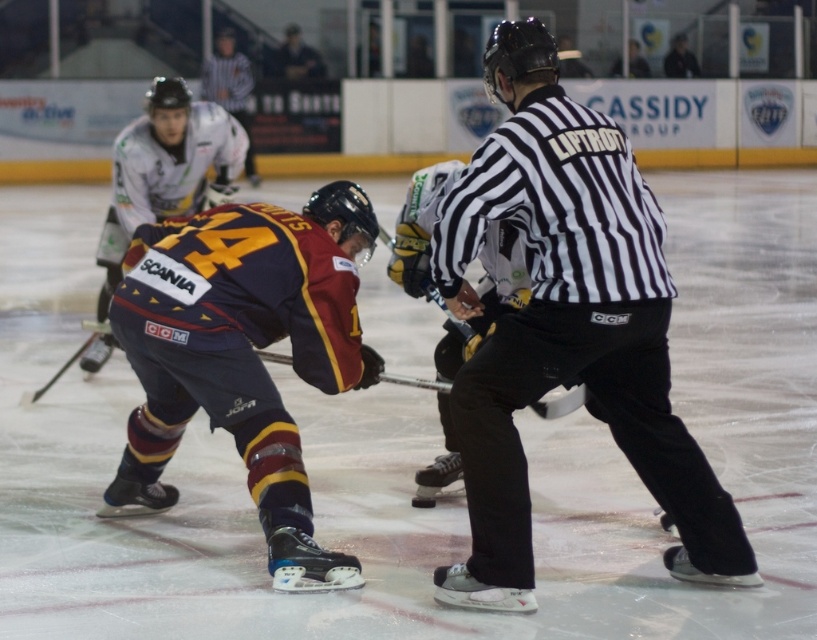
Question: Among these points, which one is nearest to the camera?

Choices:
 (A) (408, 381)
 (B) (704, 548)
 (C) (173, 196)

Answer: (B)

Question: Is black striped shirt at center positioned before maroon jersey at center?

Choices:
 (A) no
 (B) yes

Answer: (B)

Question: Which object appears closest to the camera in this image?

Choices:
 (A) black rubber hockey stick at center
 (B) maroon jersey at center
 (C) black striped shirt at center

Answer: (C)

Question: Based on their relative distances, which object is farther from the black striped shirt at center?

Choices:
 (A) maroon jersey at center
 (B) black rubber hockey stick at center

Answer: (A)

Question: Can you confirm if maroon jersey at center is positioned to the right of black rubber hockey stick at center?

Choices:
 (A) yes
 (B) no

Answer: (B)

Question: Is black striped shirt at center further to camera compared to black rubber hockey stick at center?

Choices:
 (A) no
 (B) yes

Answer: (A)